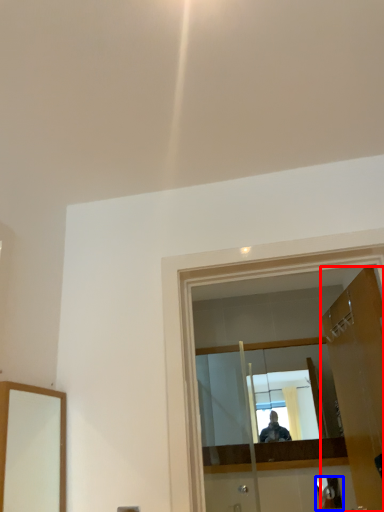
Question: Which object appears closest to the camera in this image, door (highlighted by a red box) or reflection (highlighted by a blue box)?

Choices:
 (A) door
 (B) reflection

Answer: (A)